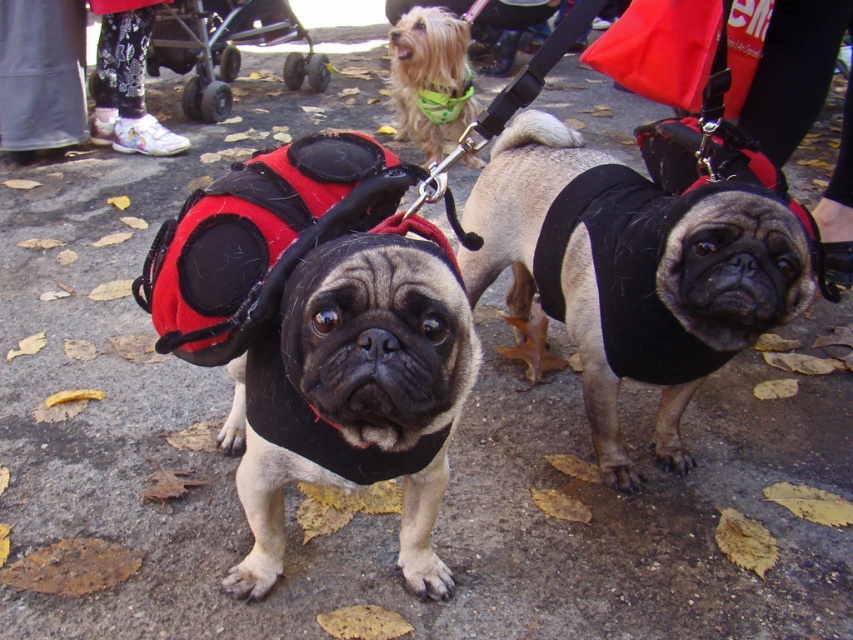
Between black soft vest at center and black plastic baby carriage at upper left, which one has more height?

black soft vest at center is taller.

Does point (717, 211) lie in front of point (202, 102)?

Yes.

Which is in front, point (592, 435) or point (289, 88)?

Point (592, 435) is more forward.

Identify the location of black soft vest at center. The width and height of the screenshot is (853, 640). (564, 276).

Is black plastic baby carriage at upper left below shiny green bandana at upper center?

No.

In the scene shown: Does black plastic baby carriage at upper left appear on the left side of shiny green bandana at upper center?

Correct, you'll find black plastic baby carriage at upper left to the left of shiny green bandana at upper center.

I want to click on black plastic baby carriage at upper left, so click(x=227, y=49).

Which is behind, point (270, 492) or point (453, 83)?

Positioned behind is point (453, 83).

What do you see at coordinates (386, 365) in the screenshot? I see `black fleece vest at center` at bounding box center [386, 365].

Which is in front, point (337, 266) or point (453, 92)?

Positioned in front is point (337, 266).

Identify the location of black fleece vest at center. This screenshot has height=640, width=853. (386, 365).